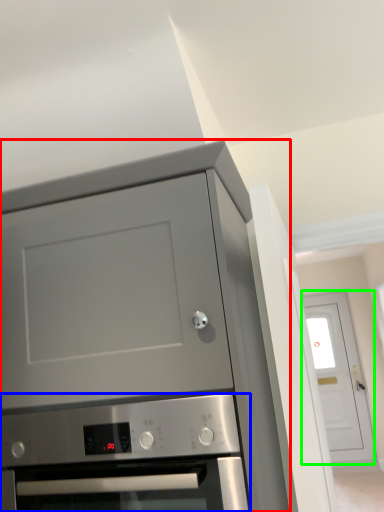
Question: Estimate the real-world distances between objects in this image. Which object is farther from cabinetry (highlighted by a red box), oven (highlighted by a blue box) or door (highlighted by a green box)?

Choices:
 (A) oven
 (B) door

Answer: (B)